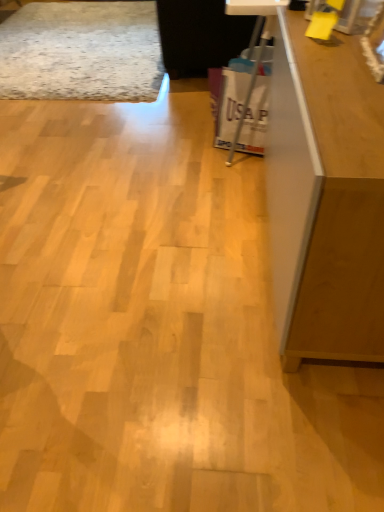
Describe the element at coordinates (325, 198) in the screenshot. The image size is (384, 512). I see `matte brown cabinet at right` at that location.

Describe the element at coordinates (258, 49) in the screenshot. This screenshot has height=512, width=384. I see `white plastic bag at center` at that location.

Locate an element on the screen. The width and height of the screenshot is (384, 512). matte brown cabinet at right is located at coordinates (325, 198).

Can you tell me how much wooden counter top at upper right and matte brown cabinet at right differ in facing direction?

Result: wooden counter top at upper right and matte brown cabinet at right are facing 0.105 degrees away from each other.

From the image's perspective, which is below, wooden counter top at upper right or matte brown cabinet at right?

matte brown cabinet at right.

Considering the relative sizes of wooden counter top at upper right and matte brown cabinet at right in the image provided, is wooden counter top at upper right bigger than matte brown cabinet at right?

No.

From a real-world perspective, between wooden counter top at upper right and matte brown cabinet at right, who is vertically higher?

From a 3D spatial view, wooden counter top at upper right is above.

From a real-world perspective, between matte brown cabinet at right and white plastic bag at center, who is vertically higher?

matte brown cabinet at right.

From the image's perspective, who appears lower, matte brown cabinet at right or white plastic bag at center?

matte brown cabinet at right.

Which of these two, matte brown cabinet at right or white plastic bag at center, stands shorter?

With less height is white plastic bag at center.

Considering the positions of objects matte brown cabinet at right and white plastic bag at center in the image provided, who is more to the right, matte brown cabinet at right or white plastic bag at center?

Positioned to the right is matte brown cabinet at right.

Considering the sizes of objects matte brown cabinet at right and wooden counter top at upper right in the image provided, who is bigger, matte brown cabinet at right or wooden counter top at upper right?

With larger size is matte brown cabinet at right.

In terms of width, does matte brown cabinet at right look wider or thinner when compared to wooden counter top at upper right?

Clearly, matte brown cabinet at right has less width compared to wooden counter top at upper right.

Locate an element on the screen. furniture lying in front of the wooden counter top at upper right is located at coordinates (325, 198).

Would you say matte brown cabinet at right is a long distance from wooden counter top at upper right?

No, matte brown cabinet at right is not far from wooden counter top at upper right.

Between point (254, 4) and point (330, 245), which one is positioned in front?

The point (330, 245) is in front.

Is white plastic bag at center facing towards matte brown cabinet at right?

No, white plastic bag at center is not oriented towards matte brown cabinet at right.

Locate an element on the screen. This screenshot has height=512, width=384. computer desk that is above the matte brown cabinet at right (from the image's perspective) is located at coordinates (258, 49).

Would you consider white plastic bag at center to be distant from matte brown cabinet at right?

white plastic bag at center is near matte brown cabinet at right, not far away.

Is white plastic bag at center oriented away from wooden counter top at upper right?

Yes.

Which of these two, white plastic bag at center or wooden counter top at upper right, stands taller?

wooden counter top at upper right is taller.

Which object is positioned more to the right, white plastic bag at center or wooden counter top at upper right?

wooden counter top at upper right.

From the image's perspective, which is above, white plastic bag at center or wooden counter top at upper right?

wooden counter top at upper right.

Looking at this image, from a real-world perspective, is wooden counter top at upper right beneath white plastic bag at center?

Actually, wooden counter top at upper right is physically above white plastic bag at center in the real world.

Is wooden counter top at upper right taller than white plastic bag at center?

Yes.

Is the surface of wooden counter top at upper right in direct contact with white plastic bag at center?

They are not placed beside each other.

In order to click on furniture below the wooden counter top at upper right (from a real-world perspective) in this screenshot , I will do `click(325, 198)`.

What are the coordinates of `furniture below the white plastic bag at center (from the image's perspective)` in the screenshot? It's located at (325, 198).

Which object lies further to the anchor point wooden counter top at upper right, matte brown cabinet at right or white plastic bag at center?

Based on the image, white plastic bag at center appears to be further to wooden counter top at upper right.

When comparing their distances from white plastic bag at center, does wooden counter top at upper right or matte brown cabinet at right seem further?

matte brown cabinet at right.

Based on their spatial positions, is matte brown cabinet at right or wooden counter top at upper right further from white plastic bag at center?

matte brown cabinet at right lies further to white plastic bag at center than the other object.

Based on their spatial positions, is white plastic bag at center or wooden counter top at upper right further from matte brown cabinet at right?

white plastic bag at center lies further to matte brown cabinet at right than the other object.

Estimate the real-world distances between objects in this image. Which object is closer to wooden counter top at upper right, white plastic bag at center or matte brown cabinet at right?

matte brown cabinet at right is positioned closer to the anchor wooden counter top at upper right.

Which object lies nearer to the anchor point matte brown cabinet at right, wooden counter top at upper right or white plastic bag at center?

wooden counter top at upper right is positioned closer to the anchor matte brown cabinet at right.

Where is `counter top between matte brown cabinet at right and white plastic bag at center along the z-axis`? counter top between matte brown cabinet at right and white plastic bag at center along the z-axis is located at coordinates (339, 100).